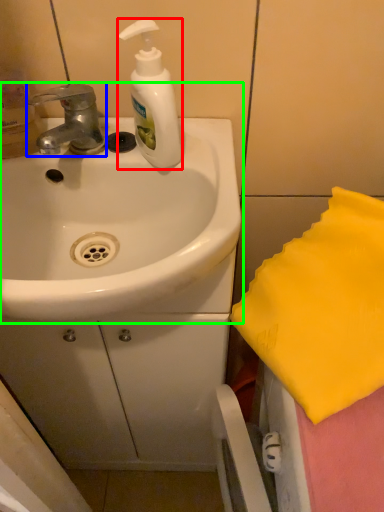
Question: Which object is the farthest from soap dispenser (highlighted by a red box)? Choose among these: tap (highlighted by a blue box) or sink (highlighted by a green box).

Choices:
 (A) tap
 (B) sink

Answer: (B)